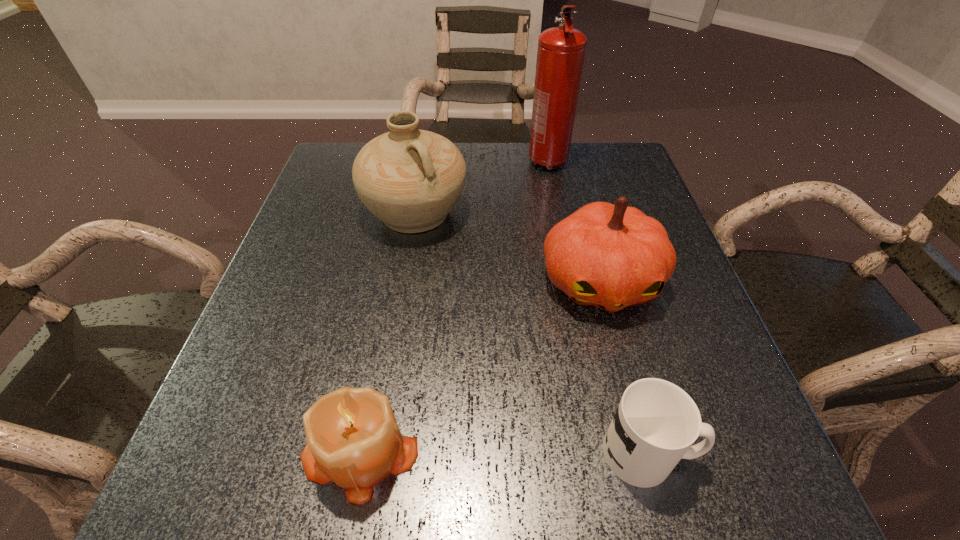
At what (x,y) coordinates should I click in order to perform the action: click on vacant space located 0.100m on the handle side of the mug. Please return your answer as a coordinate pair (x, y). The width and height of the screenshot is (960, 540). Looking at the image, I should click on (761, 453).

I want to click on fire extinguisher located at the far edge, so click(x=561, y=50).

Where is `pottery at the far edge`? The image size is (960, 540). pottery at the far edge is located at coordinates (410, 179).

Find the location of a particular element. The height and width of the screenshot is (540, 960). candle positioned at the near edge is located at coordinates (353, 439).

You are a GUI agent. You are given a task and a screenshot of the screen. Output one action in this format:
    pyautogui.click(x=<x>, y=<y>)
    Task: Click on the mug at the near edge
    
    Given the screenshot: What is the action you would take?
    pyautogui.click(x=656, y=422)

The image size is (960, 540). Find the location of `pottery that is at the left edge`. pottery that is at the left edge is located at coordinates (410, 179).

This screenshot has width=960, height=540. Identify the location of candle present at the left edge. (353, 439).

You are a GUI agent. You are given a task and a screenshot of the screen. Output one action in this format:
    pyautogui.click(x=<x>, y=<y>)
    Task: Click on the pumpkin that is positioned at the right edge
    
    Given the screenshot: What is the action you would take?
    pyautogui.click(x=609, y=256)

You are a GUI agent. You are given a task and a screenshot of the screen. Output one action in this format:
    pyautogui.click(x=<x>, y=<y>)
    Task: Click on the mug that is positioned at the right edge
    
    Given the screenshot: What is the action you would take?
    pyautogui.click(x=656, y=422)

The height and width of the screenshot is (540, 960). I want to click on object present at the far left corner, so click(x=410, y=179).